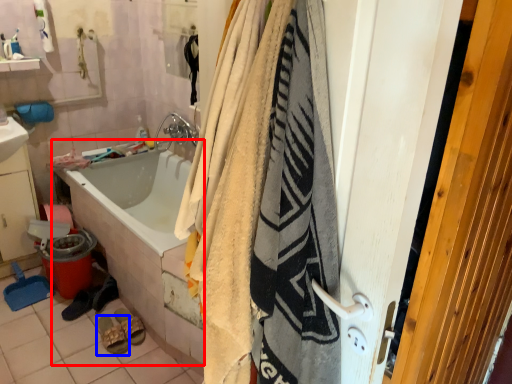
Question: Which object appears closest to the camera in this image, bath (highlighted by a red box) or footwear (highlighted by a blue box)?

Choices:
 (A) bath
 (B) footwear

Answer: (A)